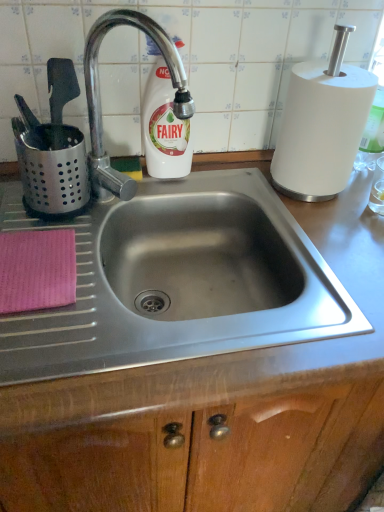
The height and width of the screenshot is (512, 384). Identify the location of vacant area that lies between white matte paper towel at upper right and white glossy bottle at upper center. (222, 180).